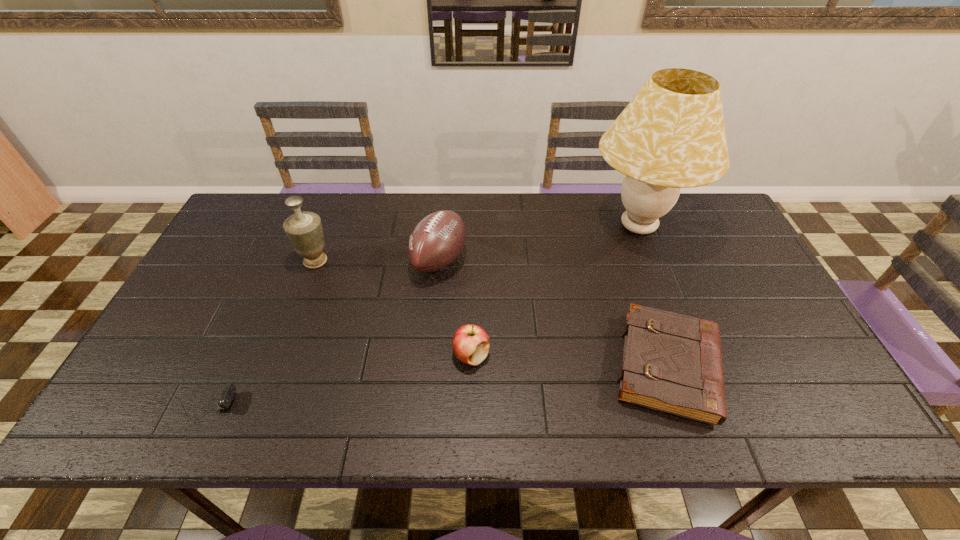
This screenshot has width=960, height=540. Find the location of `object positioned at the near left corner`. object positioned at the near left corner is located at coordinates (229, 390).

Locate an element on the screen. The height and width of the screenshot is (540, 960). object at the far right corner is located at coordinates (671, 135).

The height and width of the screenshot is (540, 960). Identify the location of vacant space at the far edge. (667, 231).

Identify the location of free space at the near edge. (324, 404).

Where is `free space at the left edge of the desktop`? This screenshot has width=960, height=540. free space at the left edge of the desktop is located at coordinates (192, 369).

In the image, there is a desktop. At what (x,y) coordinates should I click in order to perform the action: click on vacant space at the right edge. Please return your answer as a coordinate pair (x, y). The image size is (960, 540). Looking at the image, I should click on (757, 380).

Where is `vacant space at the far left corner of the desktop`? The image size is (960, 540). vacant space at the far left corner of the desktop is located at coordinates (253, 234).

Image resolution: width=960 pixels, height=540 pixels. What are the coordinates of `vacant point located between the lampshade and the leftmost object` in the screenshot? It's located at (417, 316).

The height and width of the screenshot is (540, 960). What are the coordinates of `free spot between the football (American) and the second tallest object` in the screenshot? It's located at (377, 260).

Identify the location of empty location between the fifth tallest object and the fourth tallest object. The height and width of the screenshot is (540, 960). (569, 361).